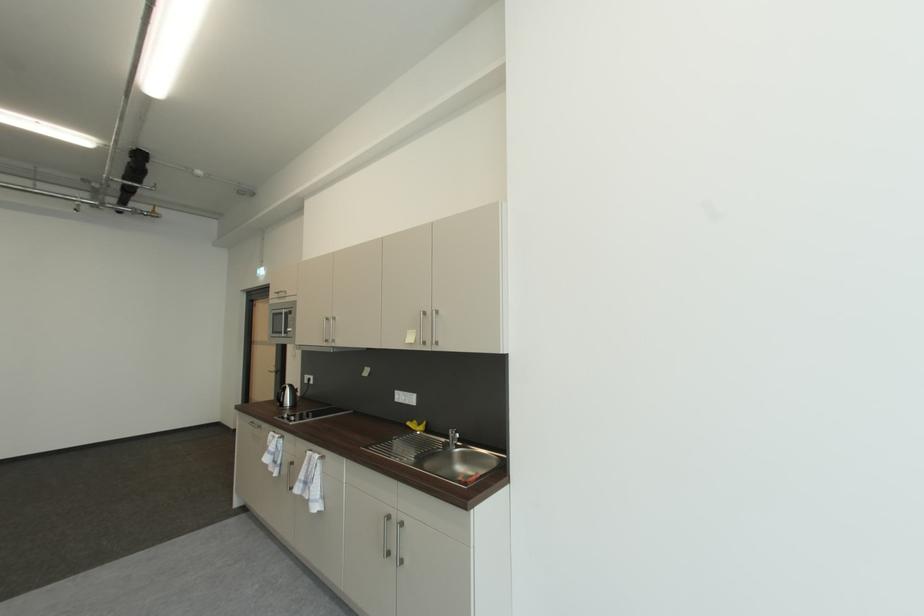
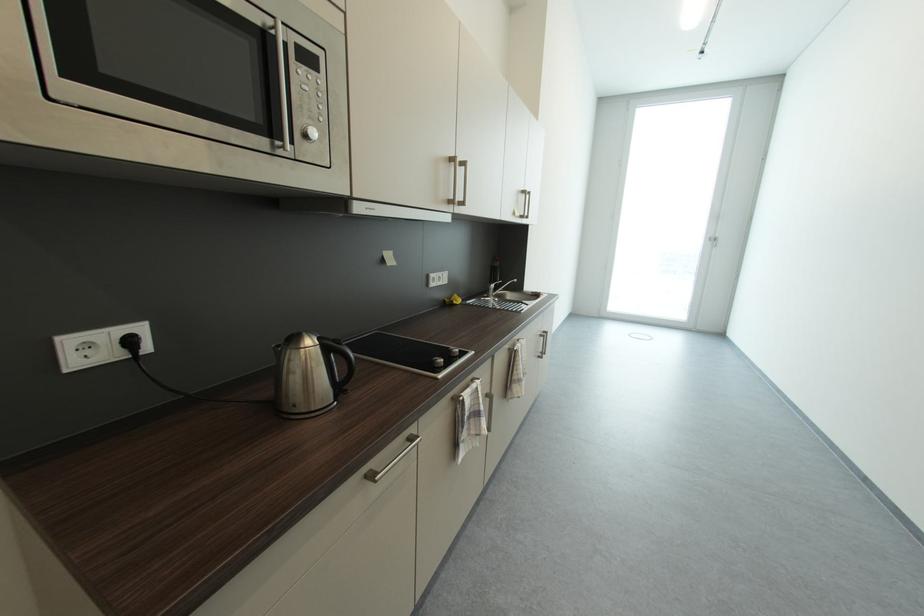
The point at (x=419, y=423) is marked in the first image. Where is the corresponding point in the second image?

(453, 302)